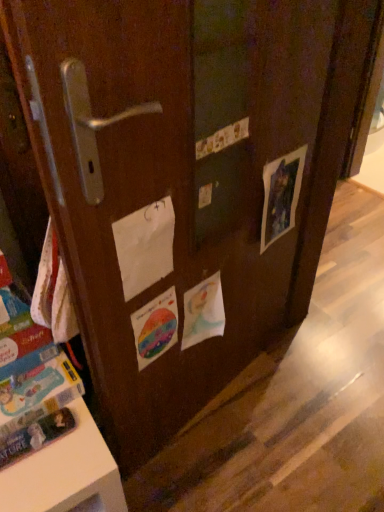
Measure the distance between white paper at center and camera.

They are 80.25 centimeters apart.

Identify the location of white paper at center. (145, 246).

I want to click on rainbow paper flyer at center, which is counted as the 1th flyer, starting from the left, so click(155, 327).

Is watercolor paper flyer at center, acting as the second flyer starting from the right, oriented towards blue cardboard book at lower left?

No, watercolor paper flyer at center, acting as the second flyer starting from the right, is not oriented towards blue cardboard book at lower left.

From the picture: How many degrees apart are the facing directions of watercolor paper flyer at center, which is the 2th flyer from left to right, and blue cardboard book at lower left?

watercolor paper flyer at center, which is the 2th flyer from left to right, and blue cardboard book at lower left are facing 8.03 degrees away from each other.

Is watercolor paper flyer at center, which is the 2th flyer from left to right, to the right of blue cardboard book at lower left from the viewer's perspective?

Indeed, watercolor paper flyer at center, which is the 2th flyer from left to right, is positioned on the right side of blue cardboard book at lower left.

From a real-world perspective, is blue cardboard book at lower left located beneath white paper at center?

Indeed, from a real-world perspective, blue cardboard book at lower left is positioned beneath white paper at center.

Considering the positions of points (64, 431) and (128, 288), is point (64, 431) closer to camera compared to point (128, 288)?

No, (64, 431) is behind (128, 288).

Which is behind, blue cardboard book at lower left or white paper at center?

blue cardboard book at lower left is more distant.

Considering the positions of objects blue cardboard book at lower left and white paper at center in the image provided, who is more to the right, blue cardboard book at lower left or white paper at center?

Positioned to the right is white paper at center.

Which of these two, white paper at center or blue cardboard book at lower left, stands shorter?

blue cardboard book at lower left.

Does point (132, 254) lie in front of point (37, 418)?

That is True.

Is white paper at center at the left side of blue cardboard book at lower left?

No, white paper at center is not to the left of blue cardboard book at lower left.

Is white paper at center thinner than matte paper picture at right, the 3th flyer when ordered from left to right?

Yes.

Does point (166, 266) come closer to viewer compared to point (283, 182)?

That is True.

Is white paper at center to the left or to the right of matte paper picture at right, positioned as the first flyer in right-to-left order, in the image?

Clearly, white paper at center is on the left of matte paper picture at right, positioned as the first flyer in right-to-left order, in the image.

Is white paper at center to the left of watercolor paper flyer at center, which is the 2th flyer from left to right, from the viewer's perspective?

Yes.

From the image's perspective, is white paper at center on watercolor paper flyer at center, acting as the second flyer starting from the right?

Yes.

From a real-world perspective, which is physically below, white paper at center or watercolor paper flyer at center, which is the 2th flyer from left to right?

From a 3D spatial view, watercolor paper flyer at center, which is the 2th flyer from left to right, is below.

Can you confirm if white paper at center is bigger than watercolor paper flyer at center, acting as the second flyer starting from the right?

No, white paper at center is not bigger than watercolor paper flyer at center, acting as the second flyer starting from the right.

Would you say watercolor paper flyer at center, which is the 2th flyer from left to right, is inside or outside matte paper picture at right, the 3th flyer when ordered from left to right?

watercolor paper flyer at center, which is the 2th flyer from left to right, is not enclosed by matte paper picture at right, the 3th flyer when ordered from left to right.

Considering the relative sizes of watercolor paper flyer at center, which is the 2th flyer from left to right, and matte paper picture at right, positioned as the first flyer in right-to-left order, in the image provided, is watercolor paper flyer at center, which is the 2th flyer from left to right, smaller than matte paper picture at right, positioned as the first flyer in right-to-left order,?

Incorrect, watercolor paper flyer at center, which is the 2th flyer from left to right, is not smaller in size than matte paper picture at right, positioned as the first flyer in right-to-left order.

Between watercolor paper flyer at center, acting as the second flyer starting from the right, and matte paper picture at right, the 3th flyer when ordered from left to right, which one has smaller width?

matte paper picture at right, the 3th flyer when ordered from left to right, is thinner.

Is watercolor paper flyer at center, which is the 2th flyer from left to right, positioned with its back to matte paper picture at right, positioned as the first flyer in right-to-left order?

That's not correct — watercolor paper flyer at center, which is the 2th flyer from left to right, is not looking away from matte paper picture at right, positioned as the first flyer in right-to-left order.

Relative to watercolor paper flyer at center, acting as the second flyer starting from the right, is blue cardboard book at lower left in front or behind?

blue cardboard book at lower left is positioned closer to the viewer than watercolor paper flyer at center, acting as the second flyer starting from the right.

Based on the photo, can you tell me how much blue cardboard book at lower left and watercolor paper flyer at center, acting as the second flyer starting from the right, differ in facing direction?

8.03 degrees.

Who is bigger, blue cardboard book at lower left or watercolor paper flyer at center, which is the 2th flyer from left to right?

With larger size is blue cardboard book at lower left.

In the scene shown: Which is farther, (77, 374) or (208, 337)?

The point (208, 337) is more distant.

From the blue cardboard book at lower left, count 2nd flyer to the right and point to it. Please provide its 2D coordinates.

[(203, 312)]

This screenshot has width=384, height=512. I want to click on book that is below the white paper at center (from the image's perspective), so click(x=39, y=405).

Looking at the image, which one is located further to watercolor paper flyer at center, acting as the second flyer starting from the right, rainbow paper flyer at center, which is counted as the 1th flyer, starting from the left, or white paper at center?

Among the two, white paper at center is located further to watercolor paper flyer at center, acting as the second flyer starting from the right.

Based on their spatial positions, is matte paper picture at right, the 3th flyer when ordered from left to right, or blue cardboard book at lower left further from white paper at center?

matte paper picture at right, the 3th flyer when ordered from left to right, is positioned further to the anchor white paper at center.

When comparing their distances from matte paper picture at right, positioned as the first flyer in right-to-left order, does white paper at center or blue cardboard book at lower left seem further?

blue cardboard book at lower left is positioned further to the anchor matte paper picture at right, positioned as the first flyer in right-to-left order.

From the image, which object appears to be farther from rainbow paper flyer at center, placed as the 3th flyer when sorted from right to left, watercolor paper flyer at center, acting as the second flyer starting from the right, or matte paper picture at right, positioned as the first flyer in right-to-left order?

matte paper picture at right, positioned as the first flyer in right-to-left order, is positioned further to the anchor rainbow paper flyer at center, placed as the 3th flyer when sorted from right to left.

Estimate the real-world distances between objects in this image. Which object is further from watercolor paper flyer at center, which is the 2th flyer from left to right, white paper at center or blue cardboard book at lower left?

Based on the image, blue cardboard book at lower left appears to be further to watercolor paper flyer at center, which is the 2th flyer from left to right.

From the image, which object appears to be farther from blue cardboard book at lower left, rainbow paper flyer at center, which is counted as the 1th flyer, starting from the left, or watercolor paper flyer at center, which is the 2th flyer from left to right?

Based on the image, watercolor paper flyer at center, which is the 2th flyer from left to right, appears to be further to blue cardboard book at lower left.

When comparing their distances from white paper at center, does matte paper picture at right, positioned as the first flyer in right-to-left order, or rainbow paper flyer at center, placed as the 3th flyer when sorted from right to left, seem closer?

rainbow paper flyer at center, placed as the 3th flyer when sorted from right to left, is positioned closer to the anchor white paper at center.

Considering their positions, is white paper at center positioned closer to watercolor paper flyer at center, acting as the second flyer starting from the right, than matte paper picture at right, positioned as the first flyer in right-to-left order?

Based on the image, white paper at center appears to be nearer to watercolor paper flyer at center, acting as the second flyer starting from the right.

The image size is (384, 512). I want to click on paper between blue cardboard book at lower left and rainbow paper flyer at center, placed as the 3th flyer when sorted from right to left, from left to right, so click(145, 246).

Locate an element on the screen. paper between blue cardboard book at lower left and watercolor paper flyer at center, which is the 2th flyer from left to right, from left to right is located at coordinates (145, 246).

This screenshot has height=512, width=384. I want to click on flyer between matte paper picture at right, positioned as the first flyer in right-to-left order, and rainbow paper flyer at center, placed as the 3th flyer when sorted from right to left, from top to bottom, so click(x=203, y=312).

You are a GUI agent. You are given a task and a screenshot of the screen. Output one action in this format:
    pyautogui.click(x=<x>, y=<y>)
    Task: Click on the flyer between blue cardboard book at lower left and watercolor paper flyer at center, which is the 2th flyer from left to right, in the horizontal direction
    This screenshot has height=512, width=384.
    Given the screenshot: What is the action you would take?
    pyautogui.click(x=155, y=327)